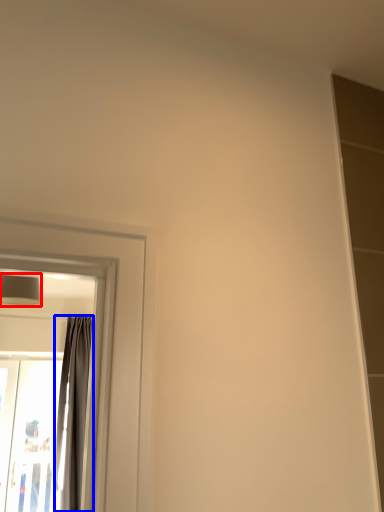
Question: Which of the following is the farthest to the observer, lamp (highlighted by a red box) or curtain (highlighted by a blue box)?

Choices:
 (A) lamp
 (B) curtain

Answer: (B)